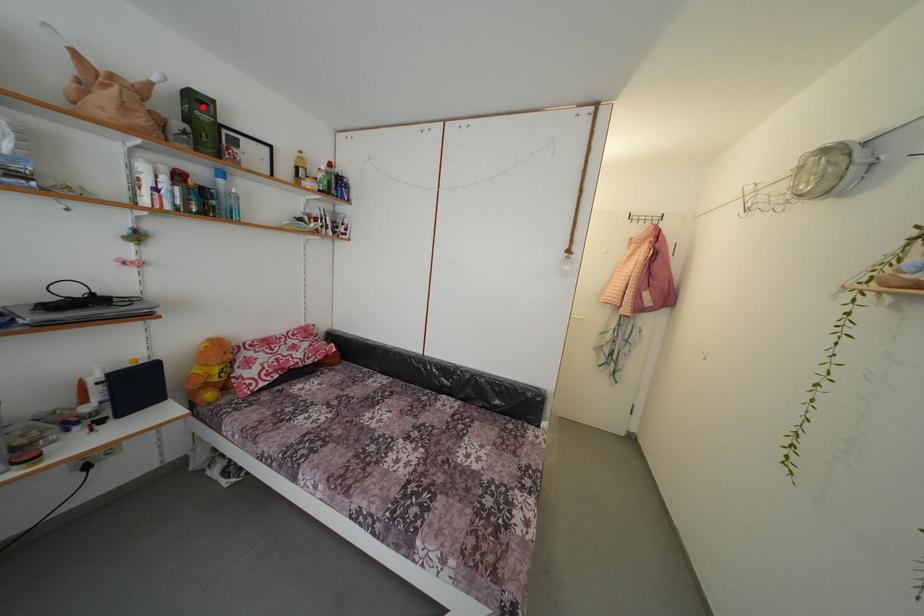
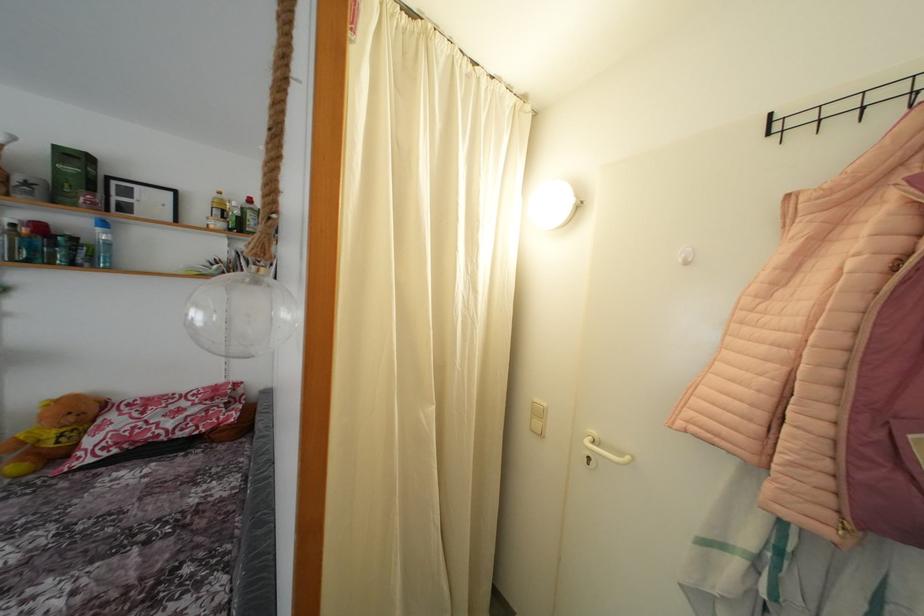
Question: I am providing you with two images of the same scene from different viewpoints. A red point is marked on the first image. Can you still see the location of the red point in image 2?

Choices:
 (A) Yes
 (B) No

Answer: (A)